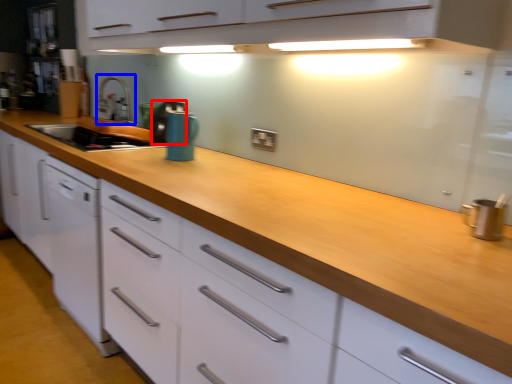
Question: Which of the following is the farthest to the observer, appliance (highlighted by a red box) or faucet (highlighted by a blue box)?

Choices:
 (A) appliance
 (B) faucet

Answer: (B)